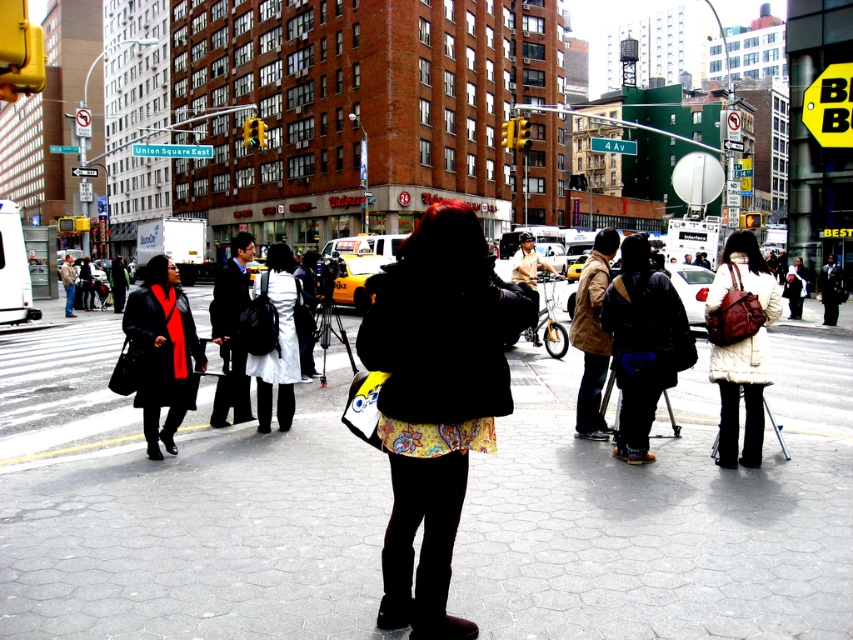
Does smooth concrete pavement at center have a greater width compared to white cotton coat at center?

Yes.

Which is below, smooth concrete pavement at center or white cotton coat at center?

smooth concrete pavement at center is lower down.

Locate an element on the screen. The width and height of the screenshot is (853, 640). smooth concrete pavement at center is located at coordinates (180, 509).

You are a GUI agent. You are given a task and a screenshot of the screen. Output one action in this format:
    pyautogui.click(x=<x>, y=<y>)
    Task: Click on the smooth concrete pavement at center
    
    Given the screenshot: What is the action you would take?
    pyautogui.click(x=180, y=509)

Based on the photo, between floral-patterned skirt at center and white fuzzy coat at center, which one has more height?

white fuzzy coat at center

Does floral-patterned skirt at center appear over white fuzzy coat at center?

Actually, floral-patterned skirt at center is below white fuzzy coat at center.

Is point (431, 477) positioned in front of point (740, 381)?

Yes, it is in front of point (740, 381).

What are the coordinates of `floral-patterned skirt at center` in the screenshot? It's located at (436, 397).

Between black leather coat at left and white cotton coat at center, which one has less height?

black leather coat at left is shorter.

In the scene shown: Who is more distant from viewer, (165, 369) or (260, 374)?

Positioned behind is point (260, 374).

Image resolution: width=853 pixels, height=640 pixels. In order to click on black leather coat at left in this screenshot , I will do `click(161, 352)`.